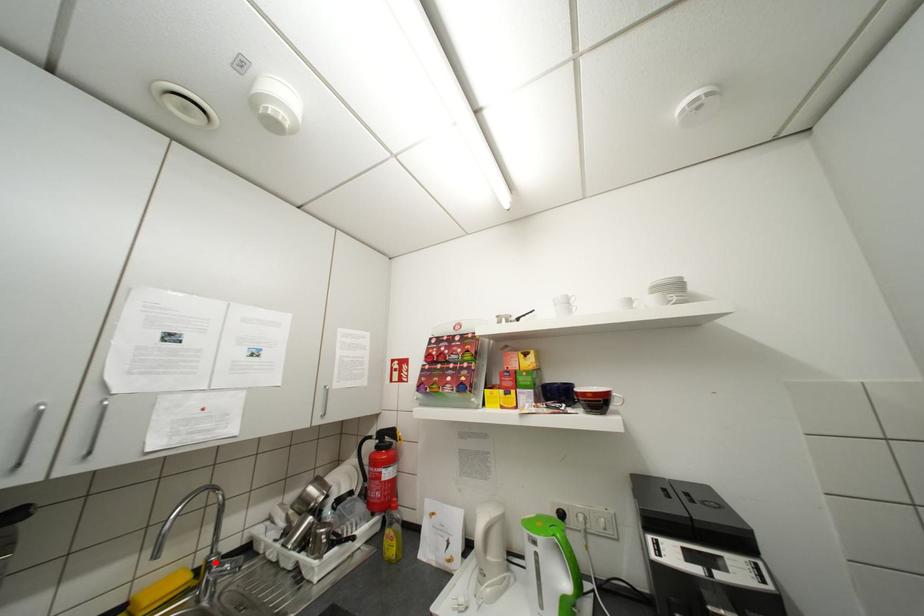
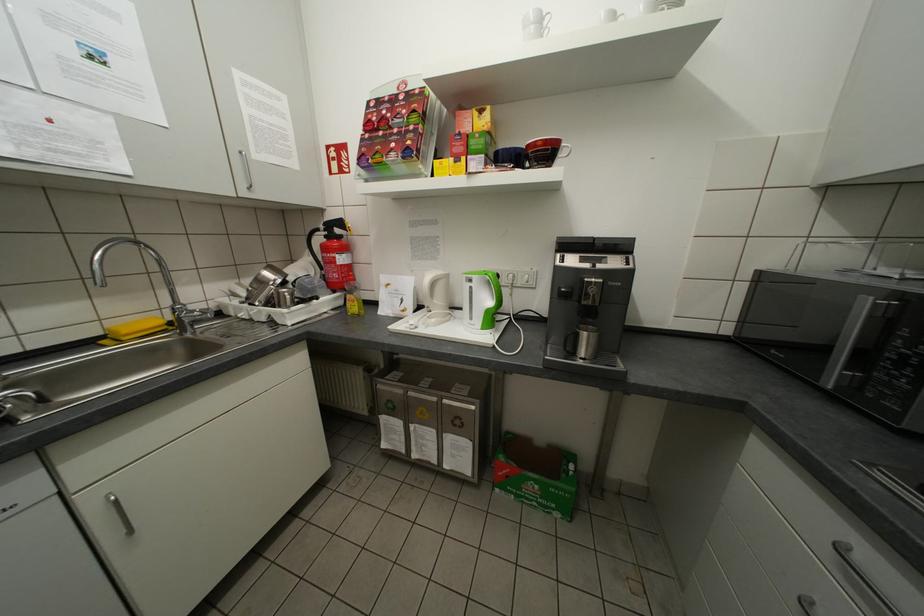
Locate, in the second image, the point that corresponds to the highlighted location in the first image.

(181, 309)